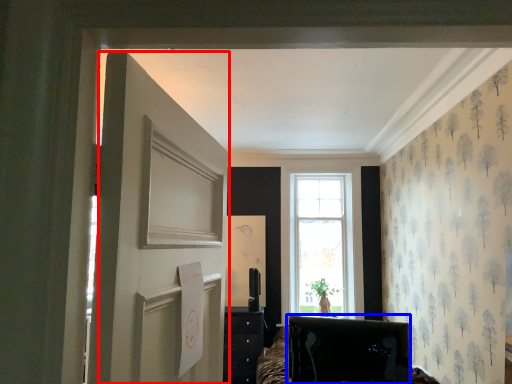
Question: Which object appears farthest to the camera in this image, door (highlighted by a red box) or furniture (highlighted by a blue box)?

Choices:
 (A) door
 (B) furniture

Answer: (B)